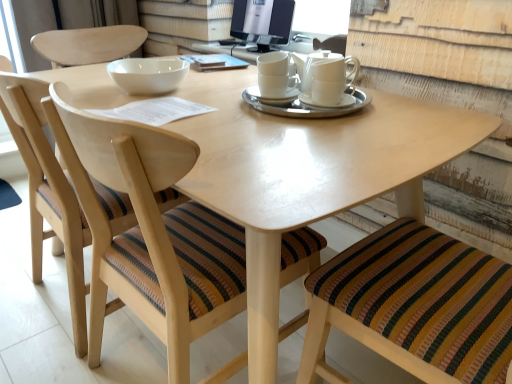
At what (x,y) coordinates should I click in order to perform the action: click on free location in front of white ceramic saucer at center, marked as the 2th saucer in a left-to-right arrangement. Please return your answer as a coordinate pair (x, y). This screenshot has height=384, width=512. Looking at the image, I should click on (320, 139).